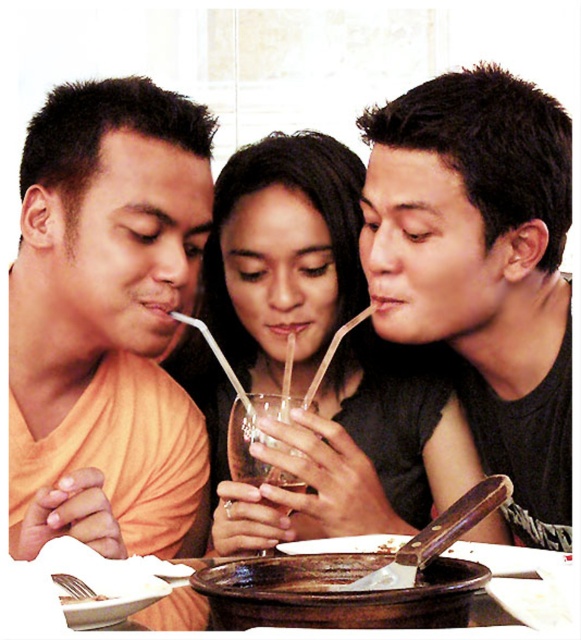
You are a server at a restaurant and need to deliver a new drink to the matte black shirt at center. The drink must be placed on the table within 12 inches of the white paper napkin at lower left. Can you place the drink close enough to the napkin?

The matte black shirt at center and white paper napkin at lower left are 23.23 inches apart from each other. Since the required distance is 12 inches, the drink cannot be placed close enough to the napkin.

You are sitting at the dining table and want to pass a napkin to the person in the matte black shirt at center without disturbing the person in the orange matte shirt at left. Can you reach them directly, or do you need to pass it through someone else?

The matte black shirt at center is further to the viewer than orange matte shirt at left, so you can reach them directly without needing to pass through the orange matte shirt at left.

You are a photographer setting up a shot of the dining table scene. You need to ensure that the matte black shirt at center and the white paper napkin at lower left are both in focus. Given their sizes, which object should you prioritize focusing on first to ensure clarity?

The matte black shirt at center is bigger than the white paper napkin at lower left, so you should prioritize focusing on the matte black shirt at center first because larger objects generally require more precise focus to maintain clarity.